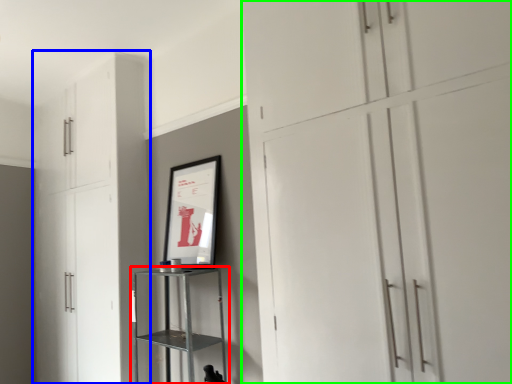
Question: Which object is the closest to the shelf (highlighted by a red box)? Choose among these: cupboard (highlighted by a blue box) or cupboard (highlighted by a green box).

Choices:
 (A) cupboard
 (B) cupboard

Answer: (A)